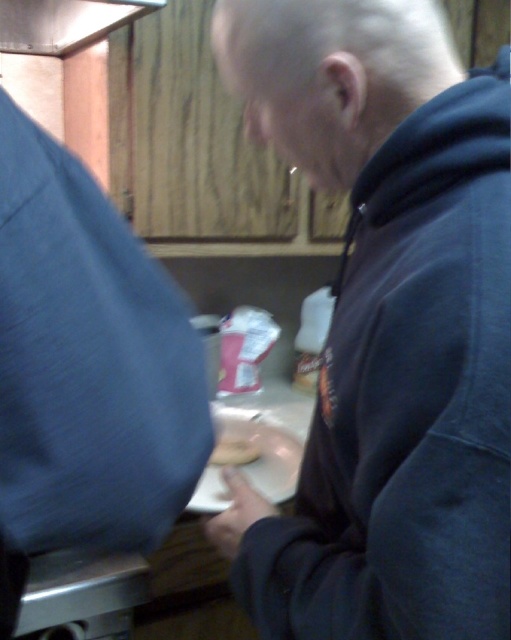
Is silver metallic oven at lower left closer to camera compared to metallic silver exhaust hood at upper left?

Yes, it is.

Which is in front, point (143, 595) or point (52, 45)?

Point (143, 595) is in front.

The image size is (511, 640). Identify the location of silver metallic oven at lower left. (81, 595).

Which is above, dark blue hoodie at center or metallic silver exhaust hood at upper left?

metallic silver exhaust hood at upper left is higher up.

Which is more to the left, dark blue hoodie at center or metallic silver exhaust hood at upper left?

Positioned to the left is metallic silver exhaust hood at upper left.

This screenshot has width=511, height=640. What do you see at coordinates (386, 326) in the screenshot?
I see `dark blue hoodie at center` at bounding box center [386, 326].

The height and width of the screenshot is (640, 511). What are the coordinates of `dark blue hoodie at center` in the screenshot? It's located at (386, 326).

Which is more to the left, dark blue hoodie at center or silver metallic oven at lower left?

From the viewer's perspective, silver metallic oven at lower left appears more on the left side.

From the picture: Who is more forward, (x=476, y=76) or (x=61, y=580)?

Point (x=476, y=76) is in front.

Is point (497, 70) closer to camera compared to point (62, 586)?

That is True.

I want to click on dark blue hoodie at center, so click(x=386, y=326).